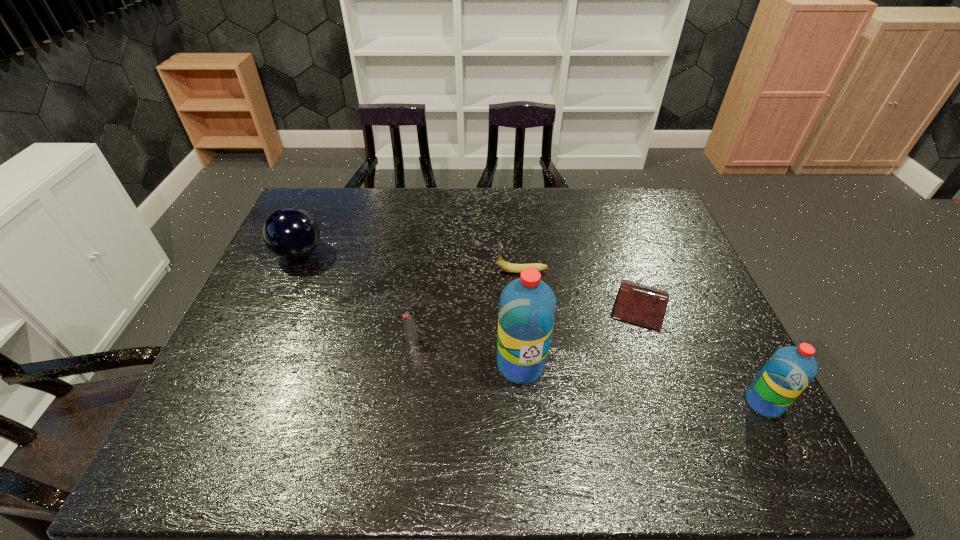
The height and width of the screenshot is (540, 960). Identify the location of igniter. click(x=409, y=321).

I want to click on free space located 0.070m on the front label of the second nearest object, so (525, 413).

What are the coordinates of `vacant space situated 0.200m at the stem of the banana` in the screenshot? It's located at (429, 271).

Identify the location of vacant area located at the stem of the banana. This screenshot has height=540, width=960. (369, 271).

Image resolution: width=960 pixels, height=540 pixels. In order to click on free region located 0.370m at the stem of the banana in this screenshot , I will do `click(372, 271)`.

What are the coordinates of `blank space located on the side of the leftmost object with the finger holes` in the screenshot? It's located at (360, 253).

Find the location of `vacant position located on the front of the second object from right to left`. vacant position located on the front of the second object from right to left is located at coordinates (663, 371).

The width and height of the screenshot is (960, 540). In order to click on blank area located 0.140m on the left of the igniter in this screenshot , I will do `click(351, 339)`.

The image size is (960, 540). What are the coordinates of `object that is at the left edge` in the screenshot? It's located at (291, 233).

Where is `water bottle at the right edge`? This screenshot has width=960, height=540. water bottle at the right edge is located at coordinates (787, 373).